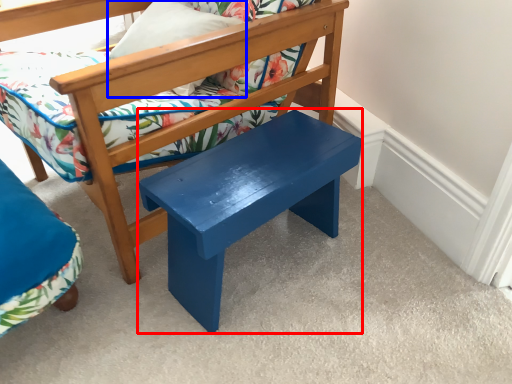
Question: Which point is further to the camera, stool (highlighted by a red box) or pillow (highlighted by a blue box)?

Choices:
 (A) stool
 (B) pillow

Answer: (B)